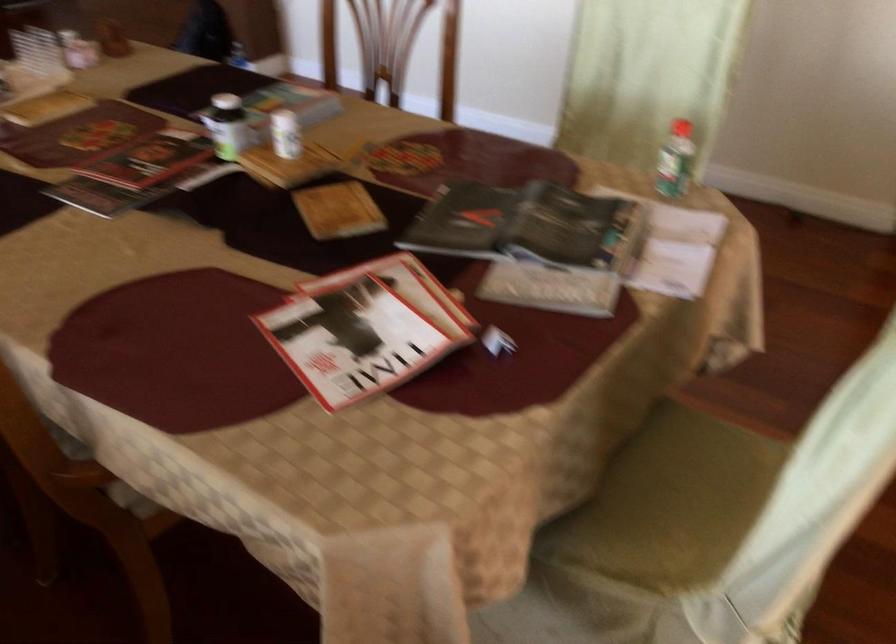
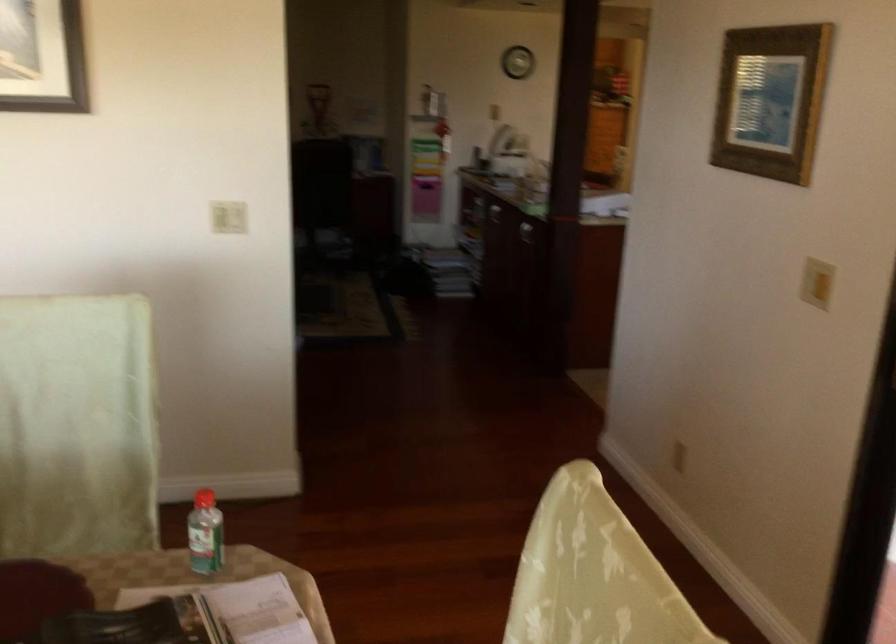
Locate, in the second image, the point that corresponds to (673,152) in the first image.

(204, 534)